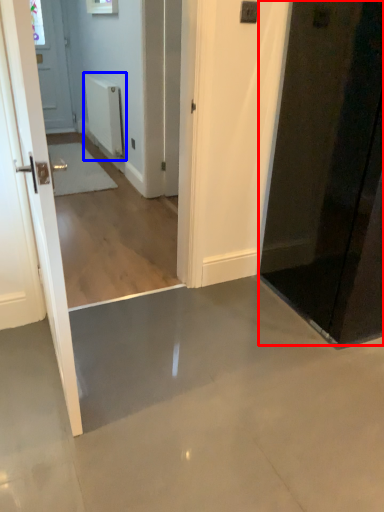
Question: Which object appears farthest to the camera in this image, door (highlighted by a red box) or radiator (highlighted by a blue box)?

Choices:
 (A) door
 (B) radiator

Answer: (B)